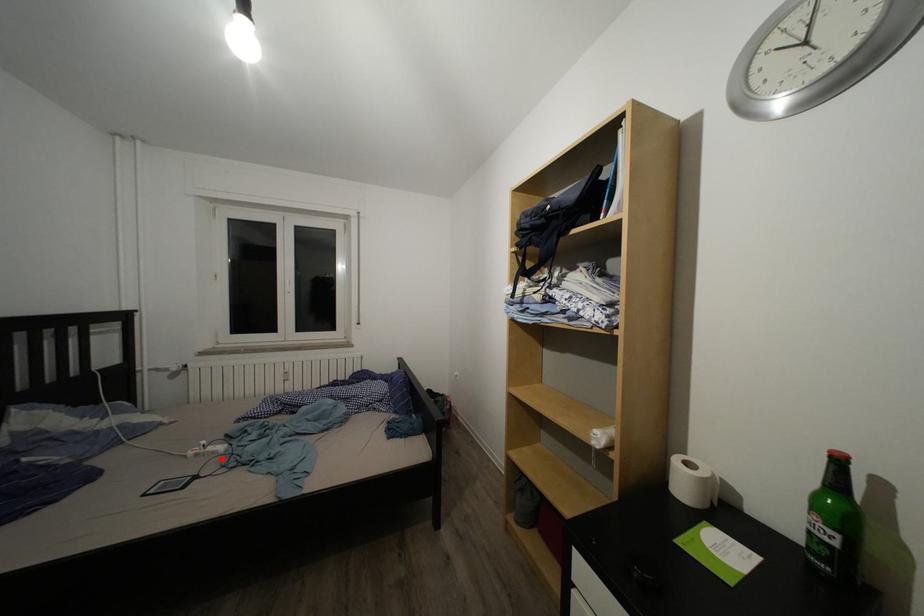
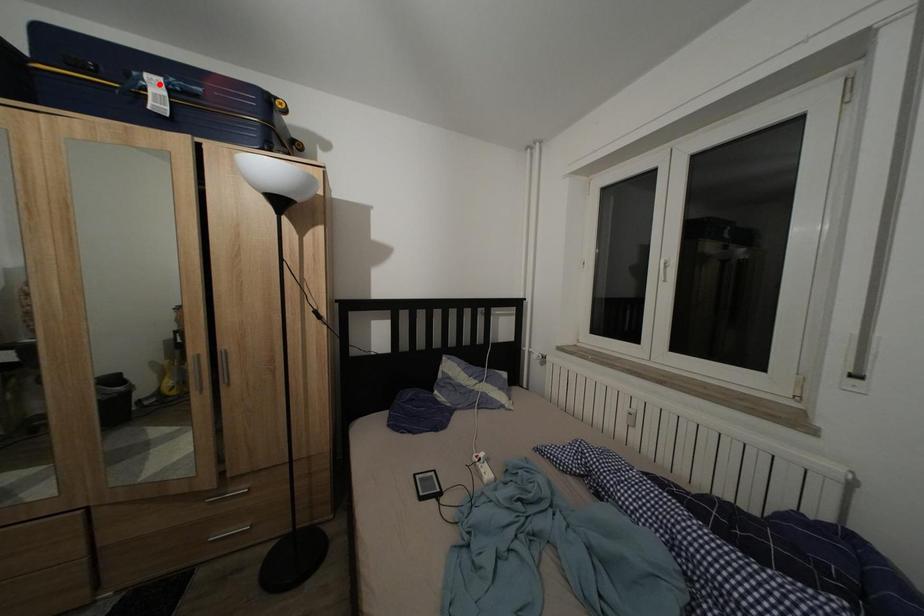
I am providing you with two images of the same scene from different viewpoints. A red point is marked on the first image and another point is marked on the second image. Is the red point in image1 aligned with the point shown in image2?

No